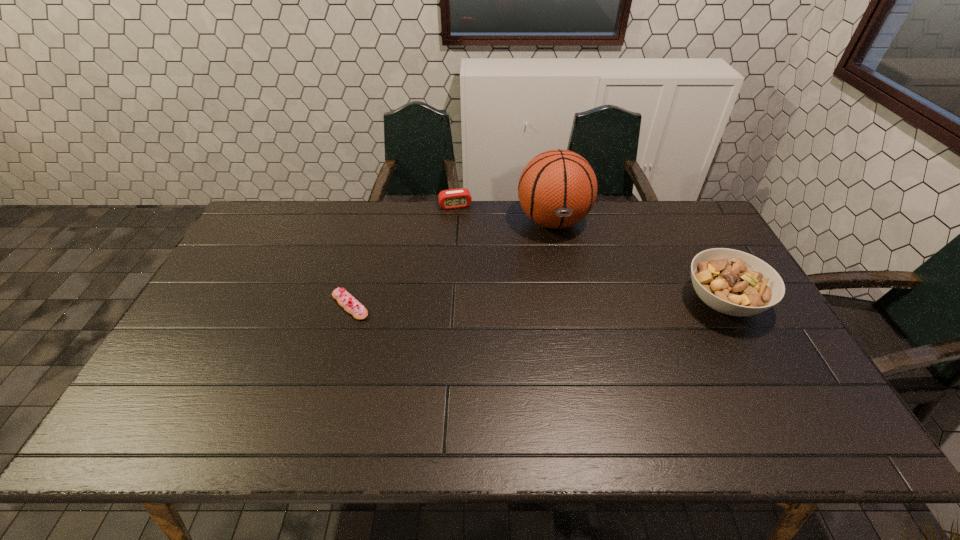
At what (x,y) coordinates should I click in order to perform the action: click on vacant space located on the side where the inflation valve is located. Please return your answer as a coordinate pair (x, y). This screenshot has height=540, width=960. Looking at the image, I should click on (584, 336).

This screenshot has height=540, width=960. Identify the location of free space located 0.290m on the side where the inflation valve is located. (577, 310).

Identify the location of free space located 0.100m on the side where the inflation valve is located. point(564,265).

At what (x,y) coordinates should I click in order to perform the action: click on vacant space located 0.160m on the front-facing side of the third object from right to left. Please return your answer as a coordinate pair (x, y). This screenshot has height=540, width=960. Looking at the image, I should click on (467, 238).

Locate an element on the screen. The width and height of the screenshot is (960, 540). blank space located on the front-facing side of the third object from right to left is located at coordinates (475, 268).

Where is `vacant region located on the front-facing side of the third object from right to left`? vacant region located on the front-facing side of the third object from right to left is located at coordinates (464, 227).

You are a GUI agent. You are given a task and a screenshot of the screen. Output one action in this format:
    pyautogui.click(x=<x>, y=<y>)
    Task: Click on the basketball located in the far edge section of the desktop
    The width and height of the screenshot is (960, 540).
    Given the screenshot: What is the action you would take?
    pyautogui.click(x=557, y=189)

Where is `alarm clock that is at the far edge`? alarm clock that is at the far edge is located at coordinates (454, 198).

You are a GUI agent. You are given a task and a screenshot of the screen. Output one action in this format:
    pyautogui.click(x=<x>, y=<y>)
    Task: Click on the object positioned at the right edge
    Image resolution: width=960 pixels, height=540 pixels.
    Given the screenshot: What is the action you would take?
    pyautogui.click(x=732, y=282)

What are the coordinates of `vacant space at the far edge of the desktop` in the screenshot? It's located at (309, 207).